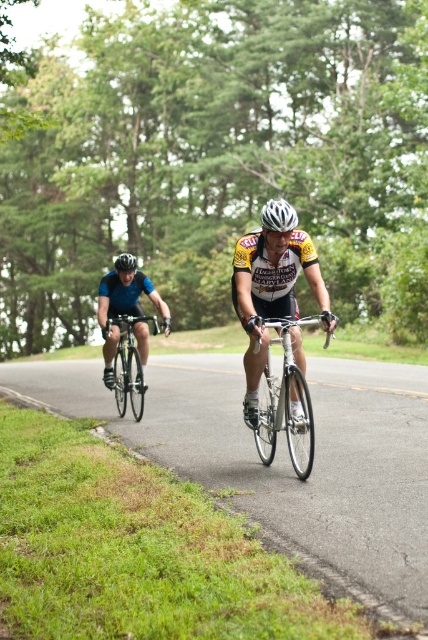
You are a photographer standing on the side of the road. You want to take a photo of both cyclists so that the silver metallic bicycle at center and the shiny silver bicycle at left appear in the frame. Which bicycle should you focus on to ensure both are in the frame without zooming in?

You should focus on the shiny silver bicycle at left because it is larger than the silver metallic bicycle at center, so keeping it in focus will help both cyclists remain in the frame without zooming in.

You are a photographer standing on the side of the road. You want to take a photo that includes both the silver metallic bicycle at center and the black matte helmet at upper center. The minimum distance between the two objects in the photo should be 20 feet. Will you need to adjust your position to achieve this?

The silver metallic bicycle at center is 18.93 feet from the black matte helmet at upper center, which is less than the required 20 feet. Therefore, you will need to move further back to increase the distance between them in the photo to meet the 20 feet requirement.